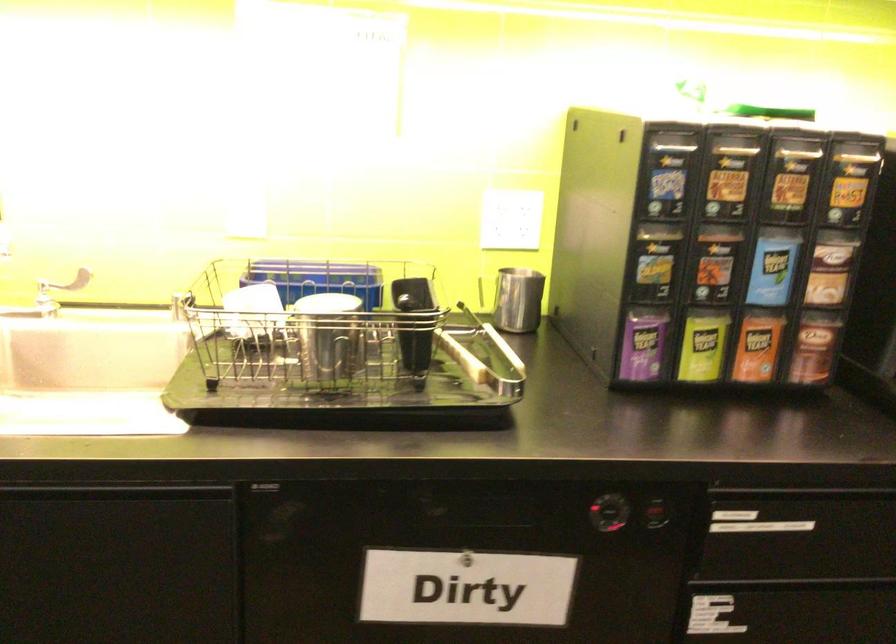
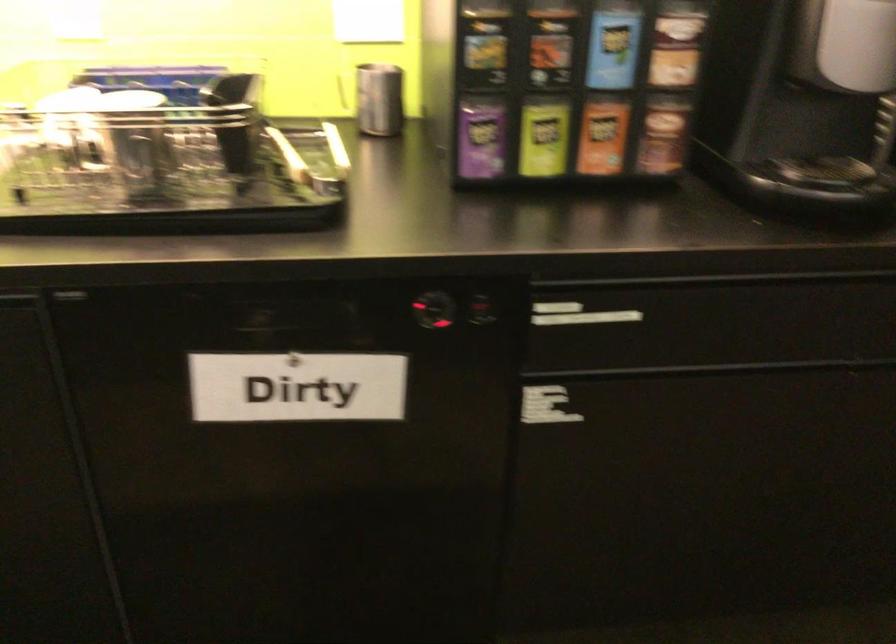
In the second image, find the point that corresponds to pixel 702 346 in the first image.

(543, 138)